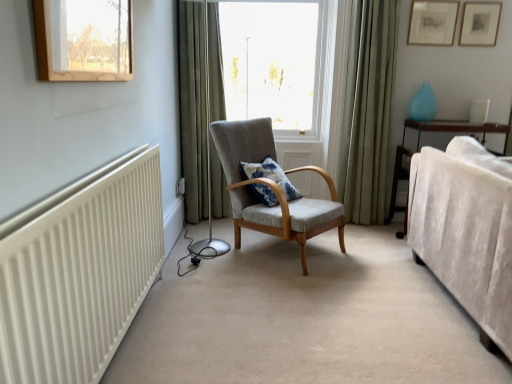
Question: Is transparent glass window at center looking in the opposite direction of green fabric curtain at right, the first curtain positioned from the right?

Choices:
 (A) yes
 (B) no

Answer: (B)

Question: Could green fabric curtain at right, the first curtain positioned from the right, be considered to be inside transparent glass window at center?

Choices:
 (A) no
 (B) yes

Answer: (A)

Question: Could you tell me if transparent glass window at center is facing green fabric curtain at right, the first curtain positioned from the right?

Choices:
 (A) no
 (B) yes

Answer: (A)

Question: Does transparent glass window at center have a smaller size compared to green fabric curtain at right, the first curtain positioned from the right?

Choices:
 (A) yes
 (B) no

Answer: (B)

Question: Considering the relative sizes of transparent glass window at center and green fabric curtain at right, which is the 2th curtain in left-to-right order, in the image provided, is transparent glass window at center taller than green fabric curtain at right, which is the 2th curtain in left-to-right order,?

Choices:
 (A) yes
 (B) no

Answer: (B)

Question: Does transparent glass window at center appear on the right side of green fabric curtain at right, the first curtain positioned from the right?

Choices:
 (A) yes
 (B) no

Answer: (B)

Question: Considering the relative sizes of matte wooden picture frame at upper right, the 1th picture frame when ordered from right to left, and blue printed cushion at center in the image provided, is matte wooden picture frame at upper right, the 1th picture frame when ordered from right to left, shorter than blue printed cushion at center?

Choices:
 (A) yes
 (B) no

Answer: (B)

Question: Does matte wooden picture frame at upper right, the 1th picture frame when ordered from right to left, have a greater width compared to blue printed cushion at center?

Choices:
 (A) yes
 (B) no

Answer: (B)

Question: Is matte wooden picture frame at upper right, the 1th picture frame when ordered from right to left, turned away from blue printed cushion at center?

Choices:
 (A) yes
 (B) no

Answer: (B)

Question: Is matte wooden picture frame at upper right, the 2th picture frame viewed from the left, closer to camera compared to blue printed cushion at center?

Choices:
 (A) no
 (B) yes

Answer: (A)

Question: Can you confirm if matte wooden picture frame at upper right, the 1th picture frame when ordered from right to left, is thinner than blue printed cushion at center?

Choices:
 (A) no
 (B) yes

Answer: (B)

Question: Considering the relative positions of matte wooden picture frame at upper right, the 2th picture frame viewed from the left, and blue printed cushion at center in the image provided, is matte wooden picture frame at upper right, the 2th picture frame viewed from the left, to the right of blue printed cushion at center from the viewer's perspective?

Choices:
 (A) no
 (B) yes

Answer: (B)

Question: Does textured gray armchair at center appear on the right side of matte wooden picture frame at upper right, the 1th picture frame when ordered from right to left?

Choices:
 (A) no
 (B) yes

Answer: (A)